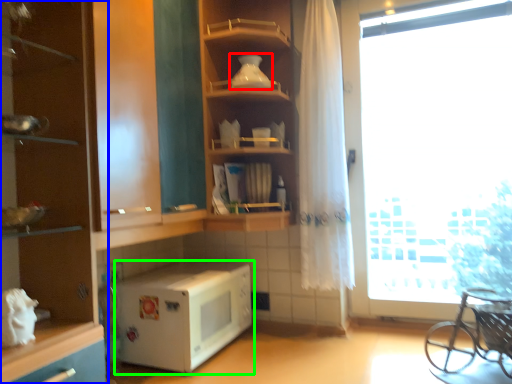
Question: Based on their relative distances, which object is nearer to appliance (highlighted by a red box)? Choose from cabinetry (highlighted by a blue box) and microwave oven (highlighted by a green box).

Choices:
 (A) cabinetry
 (B) microwave oven

Answer: (A)